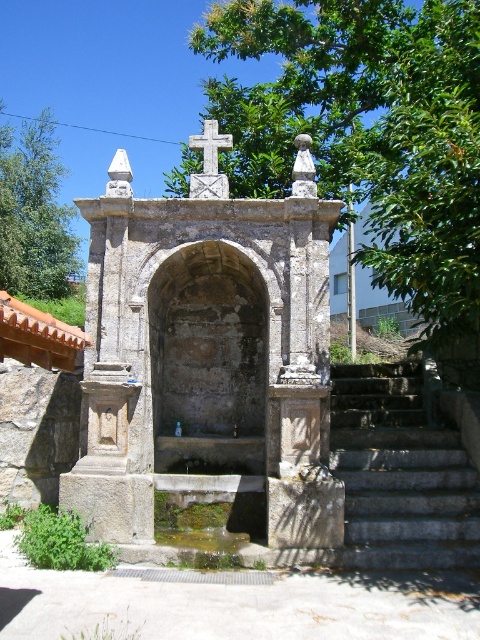
Can you confirm if stone fountain at center is smaller than white stone cross at center?

Actually, stone fountain at center might be larger than white stone cross at center.

Is stone fountain at center behind white stone cross at center?

No.

Locate an element on the screen. The height and width of the screenshot is (640, 480). stone fountain at center is located at coordinates (207, 360).

Locate an element on the screen. stone fountain at center is located at coordinates (207, 360).

Which is behind, point (132, 266) or point (38, 145)?

The point (38, 145) is more distant.

This screenshot has height=640, width=480. Describe the element at coordinates (207, 360) in the screenshot. I see `stone fountain at center` at that location.

Identify the location of stone fountain at center. (207, 360).

Between green leafy tree at upper center and gray stone stairs at lower right, which one has less height?

With less height is gray stone stairs at lower right.

Can you confirm if green leafy tree at upper center is wider than gray stone stairs at lower right?

Yes, green leafy tree at upper center is wider than gray stone stairs at lower right.

This screenshot has width=480, height=640. Find the location of `green leafy tree at upper center`. green leafy tree at upper center is located at coordinates (368, 131).